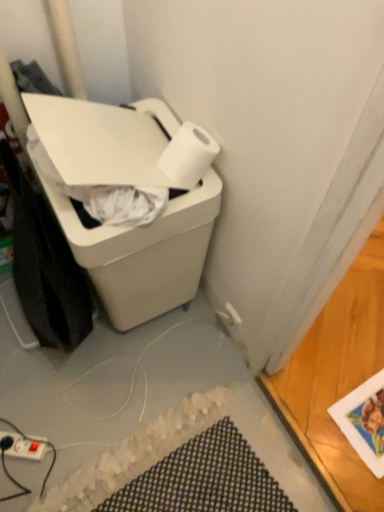
Question: Could you tell me if white plastic trash can at lower left is facing white matte paper towel at upper right?

Choices:
 (A) yes
 (B) no

Answer: (B)

Question: Is white plastic trash can at lower left directly adjacent to white matte paper towel at upper right?

Choices:
 (A) yes
 (B) no

Answer: (B)

Question: Can you confirm if white plastic trash can at lower left is thinner than white matte paper towel at upper right?

Choices:
 (A) yes
 (B) no

Answer: (B)

Question: Is white plastic trash can at lower left smaller than white matte paper towel at upper right?

Choices:
 (A) no
 (B) yes

Answer: (A)

Question: From a real-world perspective, is white plastic trash can at lower left located beneath white matte paper towel at upper right?

Choices:
 (A) yes
 (B) no

Answer: (A)

Question: Would you say white plastic trash can at lower left contains white matte paper towel at upper right?

Choices:
 (A) no
 (B) yes

Answer: (B)

Question: Can you confirm if matte white power plugs and sockets at lower left is thinner than black textured bath mat at lower center?

Choices:
 (A) no
 (B) yes

Answer: (B)

Question: Is matte white power plugs and sockets at lower left to the right of black textured bath mat at lower center from the viewer's perspective?

Choices:
 (A) no
 (B) yes

Answer: (A)

Question: Can we say matte white power plugs and sockets at lower left lies outside black textured bath mat at lower center?

Choices:
 (A) no
 (B) yes

Answer: (B)

Question: Does matte white power plugs and sockets at lower left have a smaller size compared to black textured bath mat at lower center?

Choices:
 (A) yes
 (B) no

Answer: (A)

Question: Can you confirm if matte white power plugs and sockets at lower left is positioned to the left of black textured bath mat at lower center?

Choices:
 (A) yes
 (B) no

Answer: (A)

Question: Is black textured bath mat at lower center surrounded by matte white power plugs and sockets at lower left?

Choices:
 (A) no
 (B) yes

Answer: (A)

Question: Does matte white power plugs and sockets at lower left appear on the left side of white plastic trash can at lower left?

Choices:
 (A) no
 (B) yes

Answer: (B)